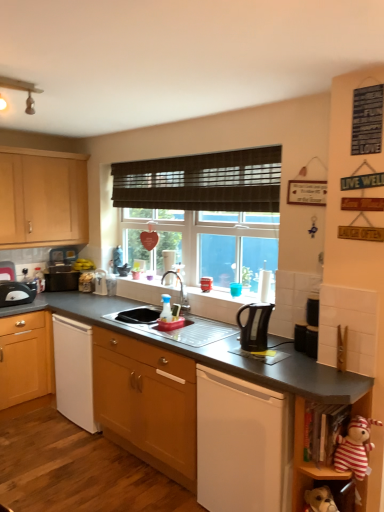
Question: Is point (337, 452) closer or farther from the camera than point (41, 212)?

Choices:
 (A) farther
 (B) closer

Answer: (B)

Question: Visually, is striped fabric stuffed animal at lower right positioned to the left or to the right of wooden cabinet at left, acting as the 1th cabinetry starting from the top?

Choices:
 (A) right
 (B) left

Answer: (A)

Question: Which is farther from the black plastic kettle at center, the second kitchen appliance positioned from the back?

Choices:
 (A) silver metallic tap at center
 (B) striped fabric stuffed animal at lower right, which ranks as the 2th shelf in top-to-bottom order
 (C) satin silver sink at center
 (D) black plastic kettle at center, which is counted as the 1th appliance, starting from the right
 (E) wooden cabinet at left, positioned as the second cabinetry in front-to-back order

Answer: (E)

Question: Which of these objects is positioned farthest from the striped fabric stuffed animal at lower right?

Choices:
 (A) silver metallic tap at center
 (B) satin silver sink at center
 (C) black plastic kettle at center, the first appliance when ordered from front to back
 (D) brown woven blind at center
 (E) black plastic kettle at center, marked as the 1th kitchen appliance in a right-to-left arrangement

Answer: (D)